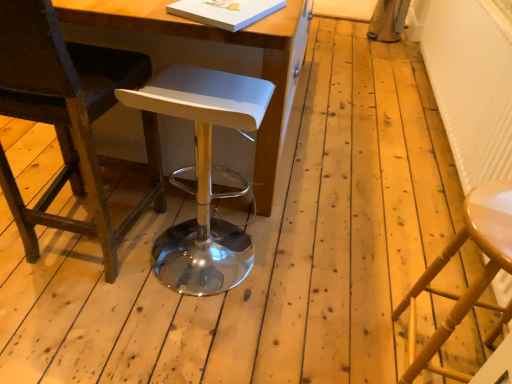
Find the location of a particular element. The image size is (512, 384). vacant space that is in between wooden table at center and white textured radiator at right is located at coordinates (347, 145).